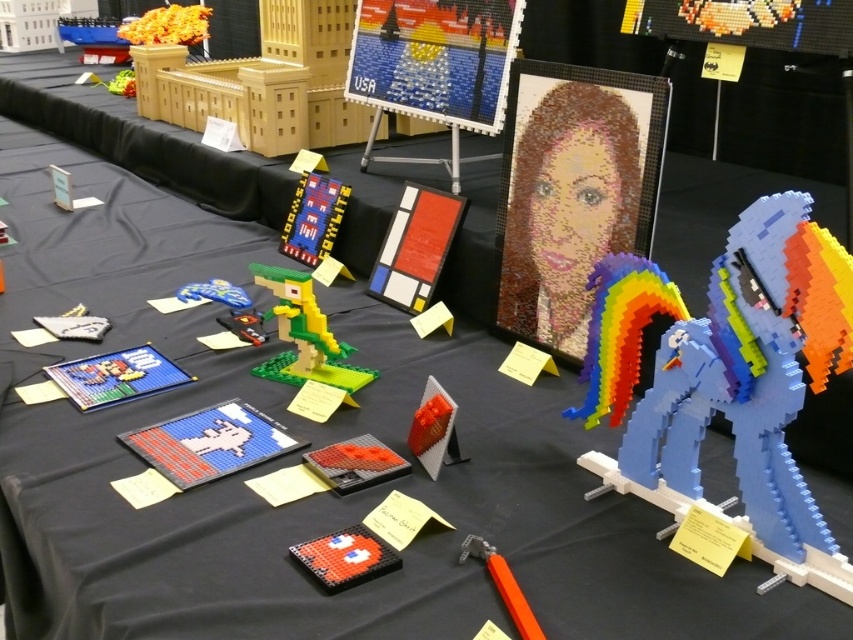
Between point (311, 349) and point (337, 490), which one is positioned behind?

The point (311, 349) is more distant.

Identify the location of green matte lego bird at center. Image resolution: width=853 pixels, height=640 pixels. (305, 336).

This screenshot has width=853, height=640. I want to click on green matte lego bird at center, so click(x=305, y=336).

Is shiny plastic rainbow-colored horse at right positioned in front of translucent orange cube at center?

Yes, it is.

Which is behind, point (831, 353) or point (430, 433)?

Positioned behind is point (430, 433).

This screenshot has height=640, width=853. In order to click on shiny plastic rainbow-colored horse at right in this screenshot , I will do `click(747, 388)`.

Is orange matte brick at center positioned in front of orange plastic hammer at lower center?

No.

Can you confirm if orange matte brick at center is shorter than orange plastic hammer at lower center?

Indeed, orange matte brick at center has a lesser height compared to orange plastic hammer at lower center.

Is point (407, 467) farther from viewer compared to point (521, 609)?

That is True.

Where is `orange matte brick at center`? Image resolution: width=853 pixels, height=640 pixels. orange matte brick at center is located at coordinates (355, 464).